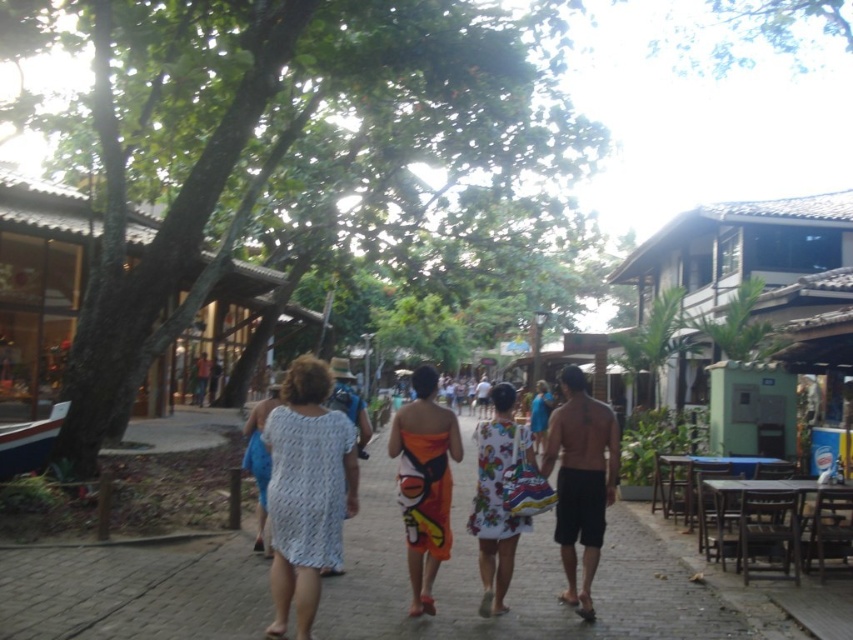
Question: Which of the following is the farthest from the observer?

Choices:
 (A) white knitted dress at center
 (B) orange printed sarong at center

Answer: (B)

Question: Where is orange printed sarong at center located in relation to white printed dress at center in the image?

Choices:
 (A) below
 (B) above

Answer: (A)

Question: Is orange printed sarong at center positioned in front of white printed dress at center?

Choices:
 (A) no
 (B) yes

Answer: (B)

Question: Which of these objects is positioned closest to the white knitted dress at center?

Choices:
 (A) white printed dress at center
 (B) orange printed sarong at center

Answer: (B)

Question: Is white knitted dress at center closer to camera compared to white printed dress at center?

Choices:
 (A) yes
 (B) no

Answer: (A)

Question: Among these points, which one is nearest to the camera?

Choices:
 (A) (476, 497)
 (B) (415, 381)

Answer: (A)